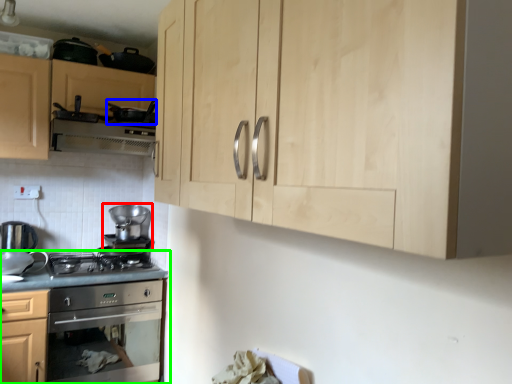
Question: Which is farther away from appliance (highlighted by a red box)? appliance (highlighted by a blue box) or countertop (highlighted by a green box)?

Choices:
 (A) appliance
 (B) countertop

Answer: (A)